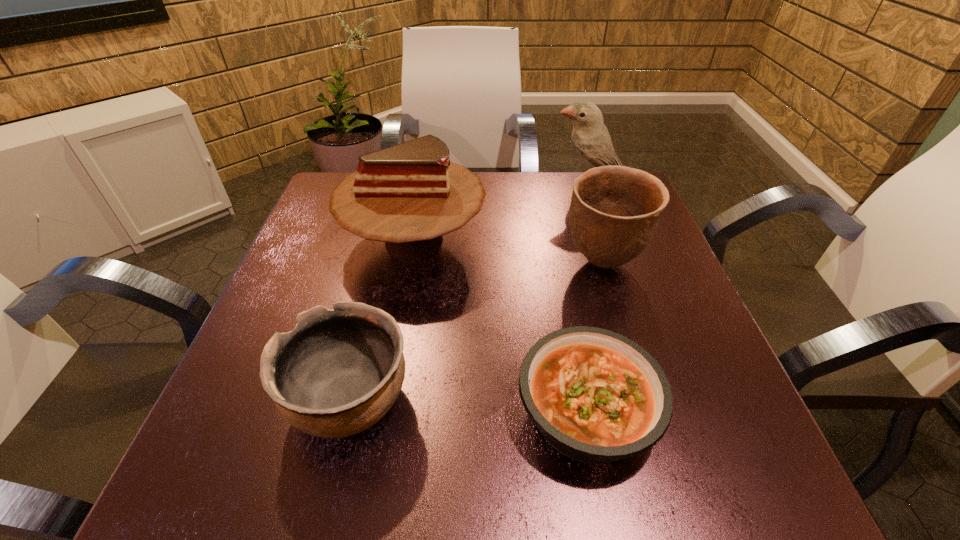
The height and width of the screenshot is (540, 960). What are the coordinates of `bird at the right edge` in the screenshot? It's located at (591, 141).

Identify the location of pottery situated at the right edge. This screenshot has width=960, height=540. point(614,212).

Locate an element on the screen. Image resolution: width=960 pixels, height=540 pixels. stew that is at the right edge is located at coordinates (596, 396).

Locate an element on the screen. This screenshot has width=960, height=540. object present at the far left corner is located at coordinates (408, 195).

Where is `object that is at the near left corner`? This screenshot has width=960, height=540. object that is at the near left corner is located at coordinates (339, 371).

Locate an element on the screen. This screenshot has width=960, height=540. object that is positioned at the far right corner is located at coordinates [591, 141].

At what (x,y) coordinates should I click in order to perform the action: click on object positioned at the near right corner. Please return your answer as a coordinate pair (x, y). Looking at the image, I should click on (596, 396).

At what (x,y) coordinates should I click in order to perform the action: click on free space at the far edge of the desktop. Please return your answer as a coordinate pair (x, y). This screenshot has width=960, height=540. Looking at the image, I should click on (522, 220).

Identify the location of free location at the left edge. (249, 418).

Image resolution: width=960 pixels, height=540 pixels. In the image, there is a desktop. Identify the location of vacant space at the right edge. (624, 307).